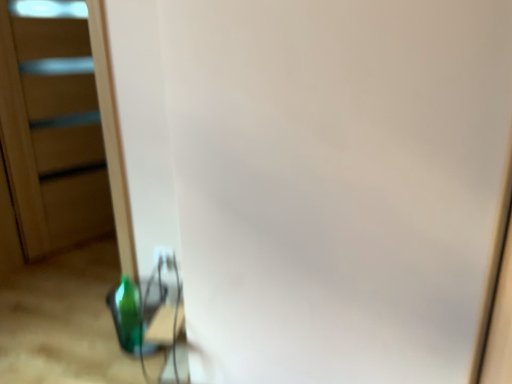
Question: Does white plastic electric outlet at lower center contain green glass bottle at lower left?

Choices:
 (A) no
 (B) yes

Answer: (A)

Question: Is white plastic electric outlet at lower center facing away from green glass bottle at lower left?

Choices:
 (A) no
 (B) yes

Answer: (A)

Question: Is white plastic electric outlet at lower center not within green glass bottle at lower left?

Choices:
 (A) no
 (B) yes

Answer: (B)

Question: Are white plastic electric outlet at lower center and green glass bottle at lower left making contact?

Choices:
 (A) yes
 (B) no

Answer: (B)

Question: Is white plastic electric outlet at lower center bigger than green glass bottle at lower left?

Choices:
 (A) yes
 (B) no

Answer: (B)

Question: Does white plastic electric outlet at lower center have a lesser width compared to green glass bottle at lower left?

Choices:
 (A) no
 (B) yes

Answer: (B)

Question: Is white plastic electric outlet at lower center surrounded by transparent plastic screen door at left?

Choices:
 (A) yes
 (B) no

Answer: (B)

Question: Can you confirm if transparent plastic screen door at left is positioned to the right of white plastic electric outlet at lower center?

Choices:
 (A) no
 (B) yes

Answer: (A)

Question: Is transparent plastic screen door at left far from white plastic electric outlet at lower center?

Choices:
 (A) yes
 (B) no

Answer: (A)

Question: Does transparent plastic screen door at left appear on the left side of white plastic electric outlet at lower center?

Choices:
 (A) yes
 (B) no

Answer: (A)

Question: Is transparent plastic screen door at left facing away from white plastic electric outlet at lower center?

Choices:
 (A) yes
 (B) no

Answer: (B)

Question: Is transparent plastic screen door at left with white plastic electric outlet at lower center?

Choices:
 (A) no
 (B) yes

Answer: (A)

Question: Does white plastic electric outlet at lower center appear on the right side of transparent plastic screen door at left?

Choices:
 (A) yes
 (B) no

Answer: (A)